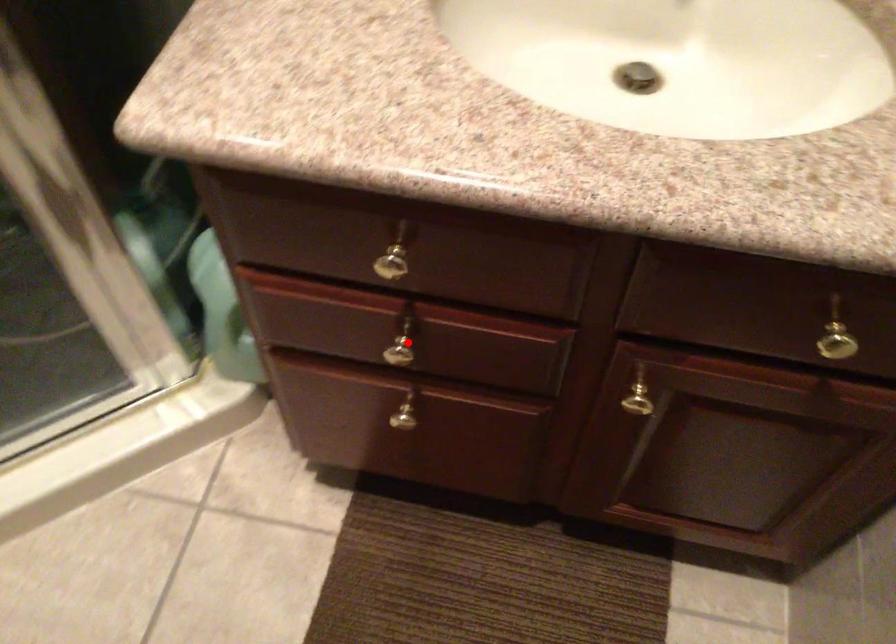
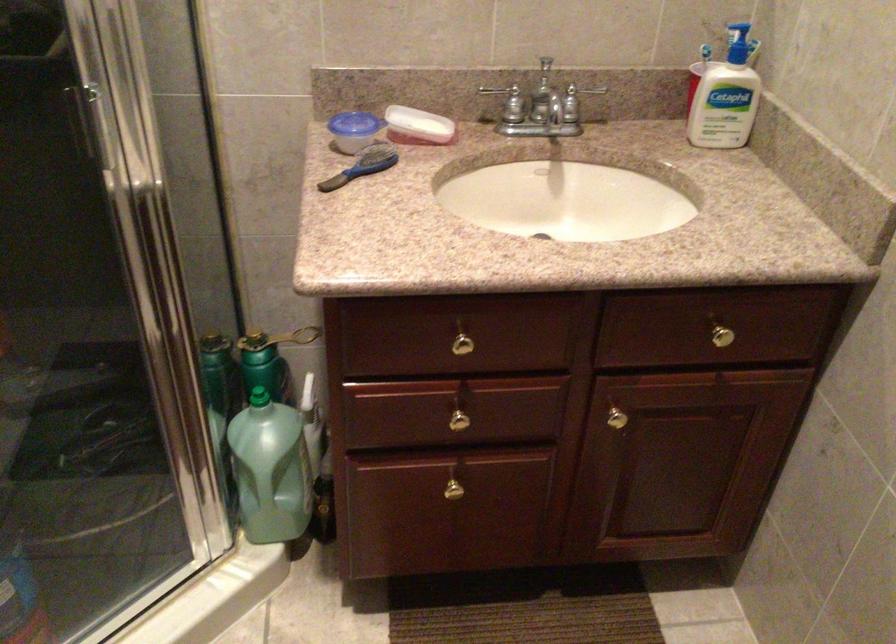
Question: I am providing you with two images of the same scene from different viewpoints. Given a red point in image1, look at the same physical point in image2. Is it:

Choices:
 (A) Closer to the viewpoint
 (B) Farther from the viewpoint

Answer: (B)